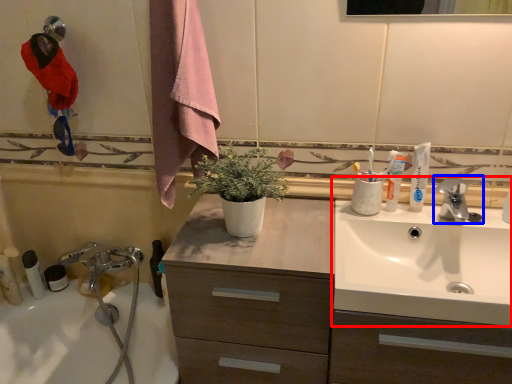
Question: Which of the following is the farthest to the observer, sink (highlighted by a red box) or tap (highlighted by a blue box)?

Choices:
 (A) sink
 (B) tap

Answer: (B)